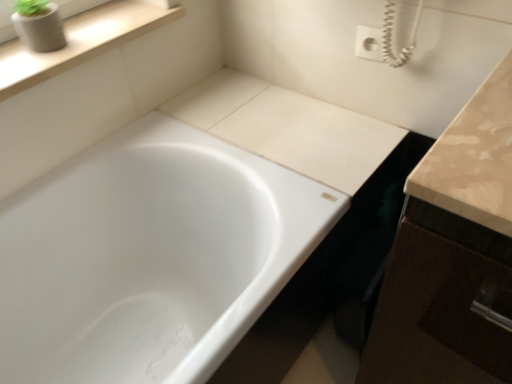
Question: Does white glossy bathtub at center appear on the left side of wooden at upper left?

Choices:
 (A) yes
 (B) no

Answer: (B)

Question: Is white glossy bathtub at center positioned far away from wooden at upper left?

Choices:
 (A) no
 (B) yes

Answer: (A)

Question: Does white glossy bathtub at center have a lesser width compared to wooden at upper left?

Choices:
 (A) no
 (B) yes

Answer: (A)

Question: Does white glossy bathtub at center lie in front of wooden at upper left?

Choices:
 (A) no
 (B) yes

Answer: (B)

Question: Is white glossy bathtub at center taller than wooden at upper left?

Choices:
 (A) yes
 (B) no

Answer: (A)

Question: Does white glossy bathtub at center have a greater width compared to wooden at upper left?

Choices:
 (A) yes
 (B) no

Answer: (A)

Question: Is white glossy bathtub at center wider than matte gray concrete planter at upper left?

Choices:
 (A) no
 (B) yes

Answer: (B)

Question: Does white glossy bathtub at center turn towards matte gray concrete planter at upper left?

Choices:
 (A) yes
 (B) no

Answer: (B)

Question: Does white glossy bathtub at center have a lesser width compared to matte gray concrete planter at upper left?

Choices:
 (A) yes
 (B) no

Answer: (B)

Question: Would you say white glossy bathtub at center is outside matte gray concrete planter at upper left?

Choices:
 (A) yes
 (B) no

Answer: (A)

Question: From a real-world perspective, is white glossy bathtub at center located higher than matte gray concrete planter at upper left?

Choices:
 (A) no
 (B) yes

Answer: (A)

Question: Is the position of white glossy bathtub at center more distant than that of matte gray concrete planter at upper left?

Choices:
 (A) yes
 (B) no

Answer: (B)

Question: Does matte gray concrete planter at upper left have a greater height compared to wooden at upper left?

Choices:
 (A) no
 (B) yes

Answer: (B)